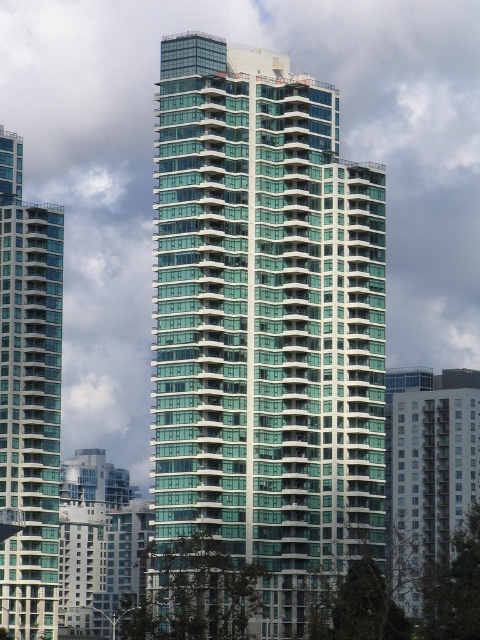
You are an architect analyzing the skyline of a city. You observe the green glass building at center and the glassy teal building at left. Which building would cast a longer shadow during midday on a clear day, assuming the sun is directly overhead?

The green glass building at center has a greater height compared to the glassy teal building at left, so it would cast a longer shadow during midday when the sun is directly overhead.